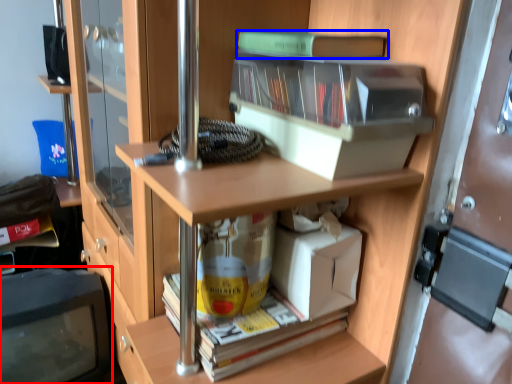
Question: Among these objects, which one is nearest to the camera, computer monitor (highlighted by a red box) or book (highlighted by a blue box)?

Choices:
 (A) computer monitor
 (B) book

Answer: (B)